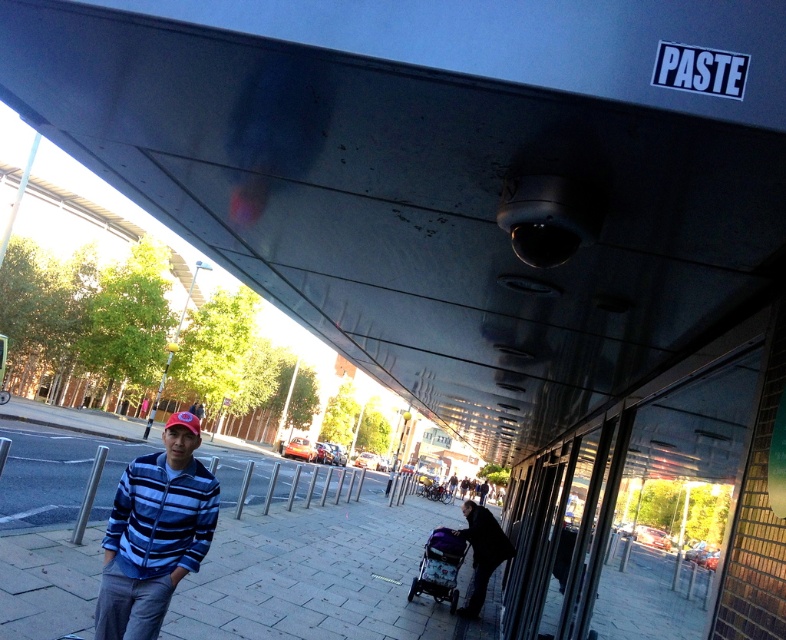
In the scene shown: You are a photographer trying to capture a clear shot of the blue striped jacket at center and the gray concrete pavement at lower left. Which object should you focus on first if you want to ensure both are in focus?

The gray concrete pavement at lower left is taller than the blue striped jacket at center, so focusing on the taller object first would help ensure both are in focus.

You are standing at the edge of the gray concrete pavement at lower left and want to reach the purple fabric stroller at center. Which direction should you move to get closer to the stroller?

Since the gray concrete pavement at lower left is closer to the viewer than the purple fabric stroller at center, you should move forward towards the stroller to get closer to it.

You are standing at the point with coordinates point (94,524) and want to walk to the point with coordinates point (483,561). Based on the scene description, will you pass by the glass wall during your journey?

Yes, because point (94,524) is in front of point (483,561), so to reach the latter you would need to walk towards the glass wall, passing by it.